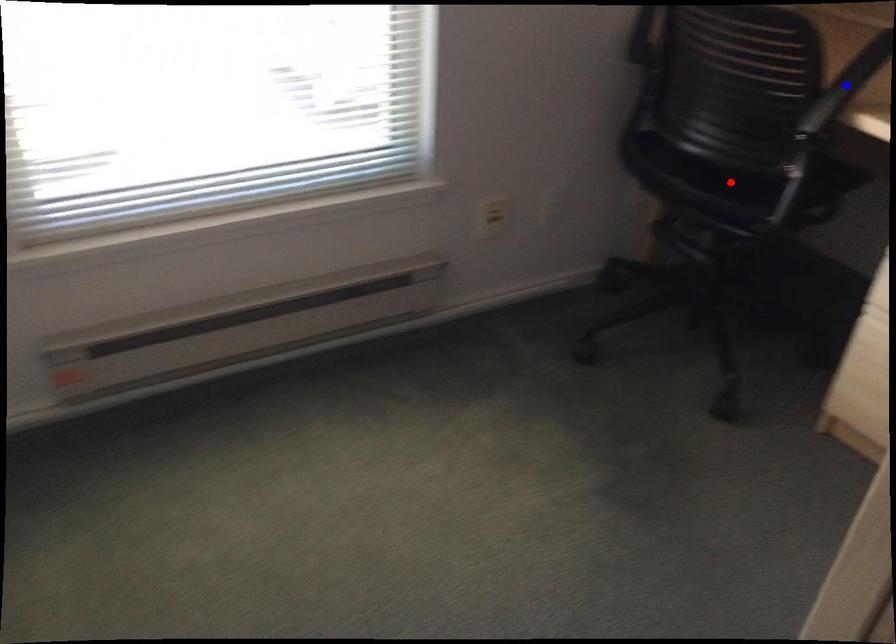
Question: In the image, two points are highlighted. Which point is nearer to the camera? Reply with the corresponding letter.

Choices:
 (A) blue point
 (B) red point

Answer: (A)